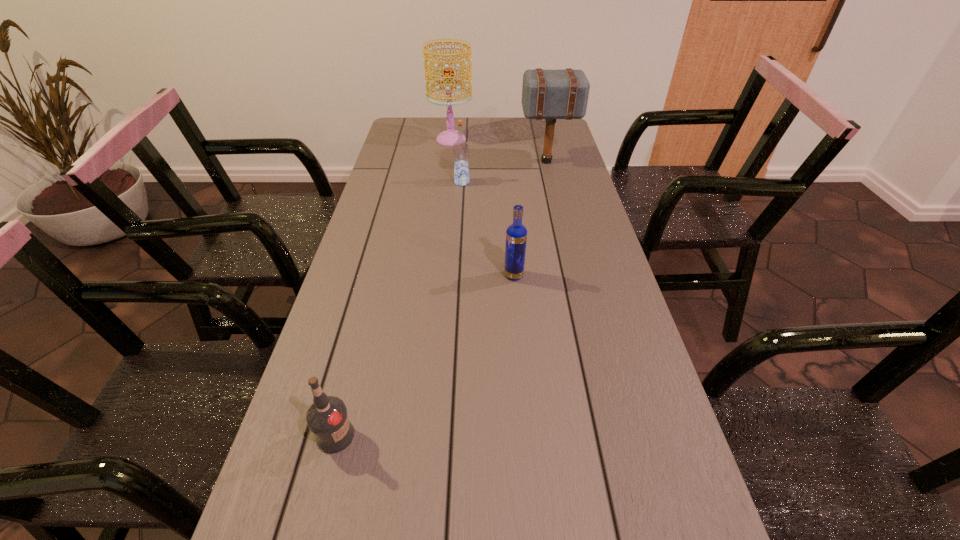
The height and width of the screenshot is (540, 960). Identify the location of object located in the far left corner section of the desktop. (450, 136).

This screenshot has height=540, width=960. In order to click on free space at the far edge of the desktop in this screenshot , I will do `click(499, 118)`.

The height and width of the screenshot is (540, 960). In order to click on vacant area at the left edge in this screenshot , I will do `click(396, 284)`.

Where is `free space at the right edge`? The height and width of the screenshot is (540, 960). free space at the right edge is located at coordinates (583, 216).

The width and height of the screenshot is (960, 540). I want to click on free space at the far left corner of the desktop, so click(x=429, y=123).

Locate an element on the screen. free area in between the leftmost object and the farthest object is located at coordinates (394, 288).

Where is `vacant space that is in between the shortest vodka and the lampshade`? The height and width of the screenshot is (540, 960). vacant space that is in between the shortest vodka and the lampshade is located at coordinates (394, 288).

Find the location of a particular element. The image size is (960, 540). vacant area between the leftmost object and the second vodka from left to right is located at coordinates pyautogui.click(x=398, y=309).

Where is `free spot between the second vodka from right to left and the rightmost object`? This screenshot has width=960, height=540. free spot between the second vodka from right to left and the rightmost object is located at coordinates (505, 172).

Find the location of a particular element. This screenshot has height=540, width=960. free area in between the shortest object and the farthest object is located at coordinates (394, 288).